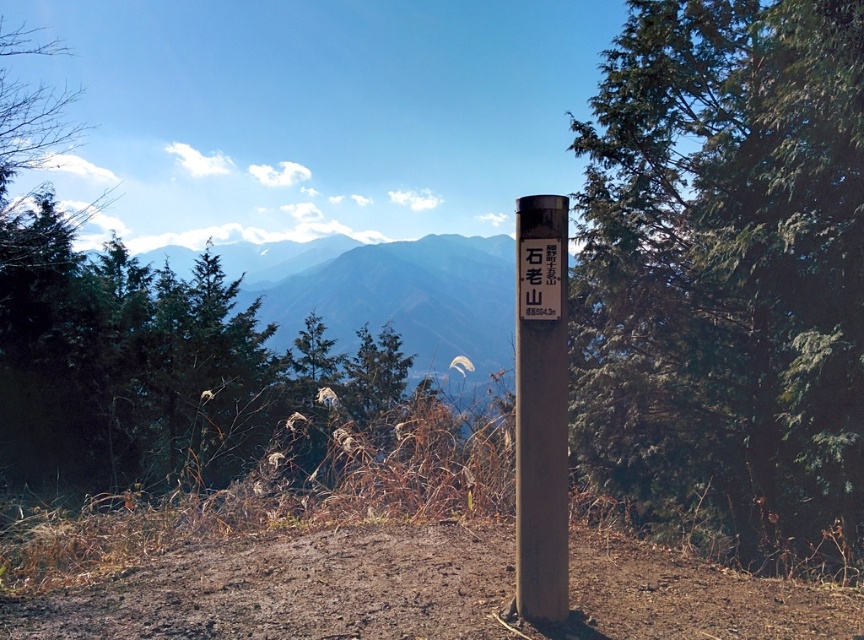
Question: Among these objects, which one is farthest from the camera?

Choices:
 (A) green textured tree at center right
 (B) smooth brown signpost at center
 (C) matte black signpost at center

Answer: (A)

Question: Which of these objects is positioned farthest from the smooth brown signpost at center?

Choices:
 (A) green textured tree at center right
 (B) matte black signpost at center

Answer: (A)

Question: Is smooth brown signpost at center positioned at the back of matte black signpost at center?

Choices:
 (A) no
 (B) yes

Answer: (A)

Question: Which point appears closest to the camera in this image?

Choices:
 (A) (751, 374)
 (B) (522, 216)
 (C) (553, 276)

Answer: (C)

Question: From the image, what is the correct spatial relationship of green textured tree at center right in relation to matte black signpost at center?

Choices:
 (A) left
 (B) right

Answer: (B)

Question: Where is green textured tree at center right located in relation to matte black signpost at center in the image?

Choices:
 (A) left
 (B) right

Answer: (B)